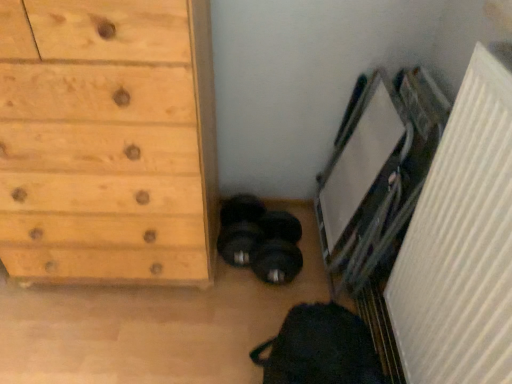
At what (x,y) coordinates should I click in order to perform the action: click on free spot in front of natural wood chest of drawers at left. Please return your answer as a coordinate pair (x, y). This screenshot has height=384, width=512. Looking at the image, I should click on (106, 331).